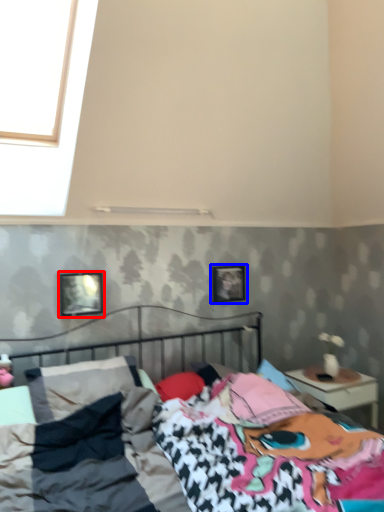
Question: Which object appears farthest to the camera in this image, picture frame (highlighted by a red box) or picture frame (highlighted by a blue box)?

Choices:
 (A) picture frame
 (B) picture frame

Answer: (B)